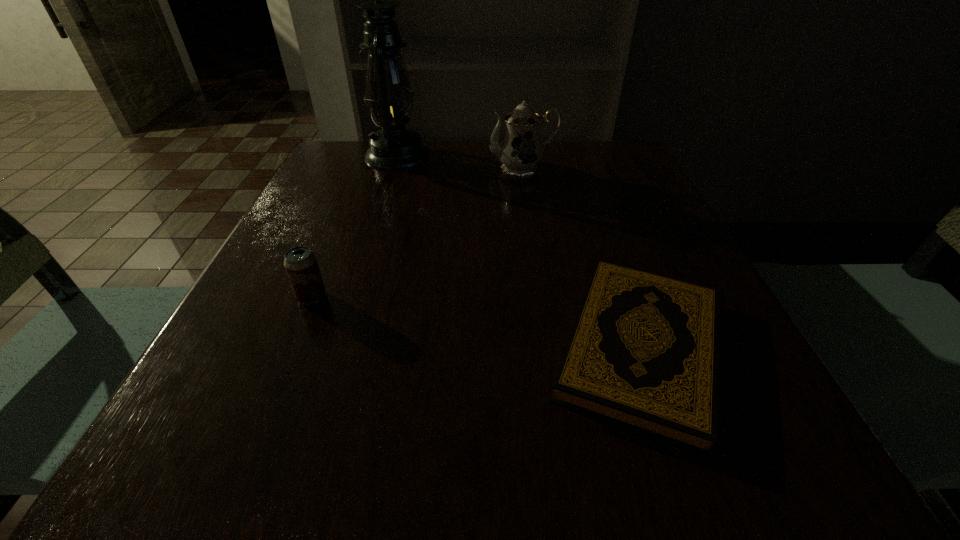
Identify the location of free spot between the shortest object and the chinaware. Image resolution: width=960 pixels, height=540 pixels. (582, 258).

Find the location of a particular element. This screenshot has width=960, height=540. vacant space that's between the chinaware and the third tallest object is located at coordinates (418, 233).

Where is `vacant region between the oil lamp and the beer can`? This screenshot has width=960, height=540. vacant region between the oil lamp and the beer can is located at coordinates (354, 226).

What are the coordinates of `vacant area between the second shortest object and the chinaware` in the screenshot? It's located at (418, 233).

Where is `object that is the second closest to the chinaware`? object that is the second closest to the chinaware is located at coordinates (643, 353).

Select which object is the closest to the shortest object. Please provide its 2D coordinates. Your answer should be formatted as a tuple, i.e. [(x, y)], where the tuple contains the x and y coordinates of a point satisfying the conditions above.

[(520, 152)]

This screenshot has height=540, width=960. In order to click on blank area in the image that satisfies the following two spatial constraints: 1. on the front side of the tallest object; 2. on the left side of the shortest object in this screenshot , I will do `click(337, 348)`.

Identify the location of vacant space that satisfies the following two spatial constraints: 1. on the back side of the beer can; 2. on the left side of the chinaware. (366, 168).

Find the location of a particular element. The image size is (960, 540). free region that satisfies the following two spatial constraints: 1. on the back side of the chinaware; 2. on the right side of the beer can is located at coordinates (366, 168).